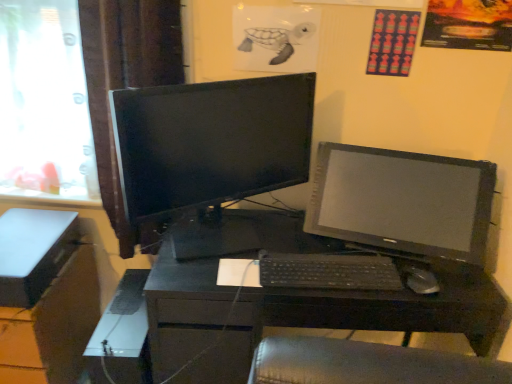
Question: Should I look upward or downward to see matte black file cabinet at lower left?

Choices:
 (A) up
 (B) down

Answer: (B)

Question: From the image's perspective, is transparent glass window at left located beneath brown fabric curtain at left?

Choices:
 (A) no
 (B) yes

Answer: (A)

Question: From a real-world perspective, is transparent glass window at left positioned over brown fabric curtain at left based on gravity?

Choices:
 (A) no
 (B) yes

Answer: (B)

Question: Does transparent glass window at left have a greater height compared to brown fabric curtain at left?

Choices:
 (A) no
 (B) yes

Answer: (A)

Question: Considering the relative positions of transparent glass window at left and brown fabric curtain at left in the image provided, is transparent glass window at left in front of brown fabric curtain at left?

Choices:
 (A) no
 (B) yes

Answer: (A)

Question: From a real-world perspective, is transparent glass window at left located beneath brown fabric curtain at left?

Choices:
 (A) no
 (B) yes

Answer: (A)

Question: Could you tell me if transparent glass window at left is facing brown fabric curtain at left?

Choices:
 (A) no
 (B) yes

Answer: (A)

Question: Is the depth of black matte desk at center less than that of brown fabric curtain at left?

Choices:
 (A) no
 (B) yes

Answer: (B)

Question: Would you say black matte desk at center is a long distance from brown fabric curtain at left?

Choices:
 (A) yes
 (B) no

Answer: (B)

Question: Can you confirm if black matte desk at center is taller than brown fabric curtain at left?

Choices:
 (A) no
 (B) yes

Answer: (A)

Question: From a real-world perspective, is black matte desk at center positioned over brown fabric curtain at left based on gravity?

Choices:
 (A) no
 (B) yes

Answer: (A)

Question: Is black matte desk at center turned away from brown fabric curtain at left?

Choices:
 (A) no
 (B) yes

Answer: (A)

Question: Can you confirm if black matte desk at center is thinner than brown fabric curtain at left?

Choices:
 (A) no
 (B) yes

Answer: (A)

Question: Is satin black monitor at right, positioned as the first computer monitor in right-to-left order, outside transparent glass window at left?

Choices:
 (A) yes
 (B) no

Answer: (A)